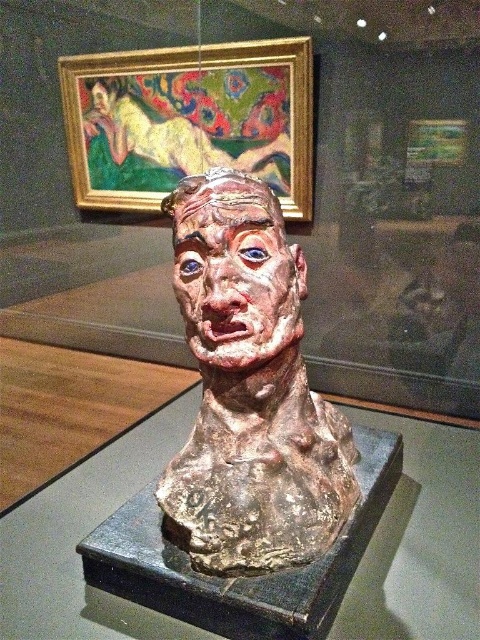
You are an art student analyzing the sculpture in the museum. You observe the matte clay bust at center and the matte clay face at center. Which object has a greater width?

The matte clay bust at center has a greater width than the matte clay face at center.

You are a visitor in the museum and want to take a photo of both the matte clay bust at center and the matte clay face at center. Since you can only focus on one object at a time, which one should you adjust your camera to focus on first to ensure it appears sharp in the photo?

The matte clay bust at center is positioned under the matte clay face at center, so you should focus on the matte clay face at center first because it is closer to the camera.

You are an art student analyzing the sculpture in the museum. You notice two parts of the sculpture labeled as the matte clay bust at center and the matte clay face at upper center. Which part has a greater width?

The matte clay bust at center has a greater width than the matte clay face at upper center.